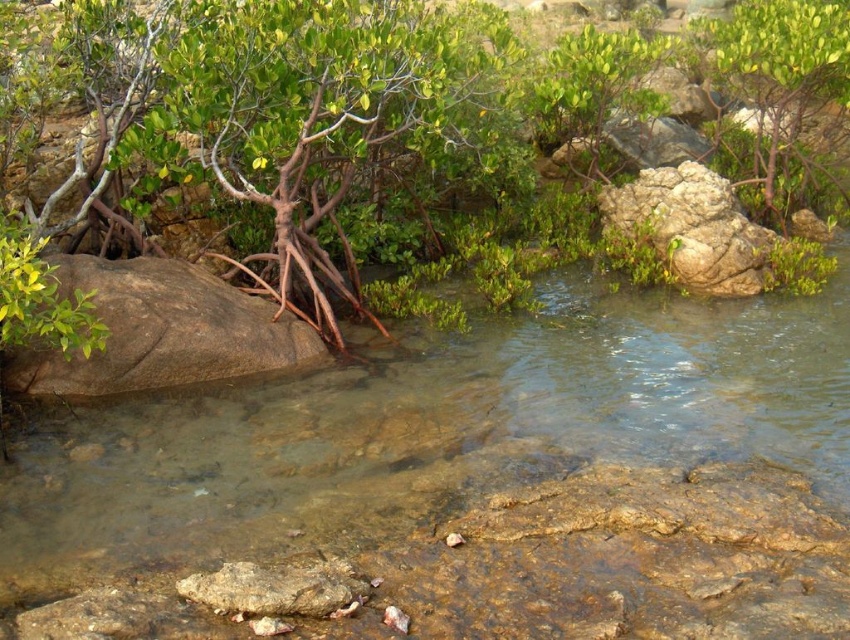
You are standing at the edge of the water in the scene. You want to reach the green matte tree at upper right without stepping into the water. Which direction should you move from the clear water at center?

You should move to the right from the clear water at center to reach the green matte tree at upper right since the clear water at center is to the left of the green matte tree at upper right.

You are a drone operator trying to capture a photo of the tidal pool. You have two points marked on your map, point A at coordinates point (428,582) and point B at coordinates point (173,337). Which point is closer to the drone camera when flying directly above the tidal pool?

Point point (428,582) is in front of point point (173,337), so it will be closer to the drone camera when flying directly above the tidal pool.

You are a small crab trying to cross from the brown rough boulder at lower left to the clear water at center. Can you fit through the space between them?

The clear water at center is thinner than the brown rough boulder at lower left, so the space between them might be narrow. However, since the crab is small, it might be able to fit through the space between the clear water at center and the brown rough boulder at lower left.